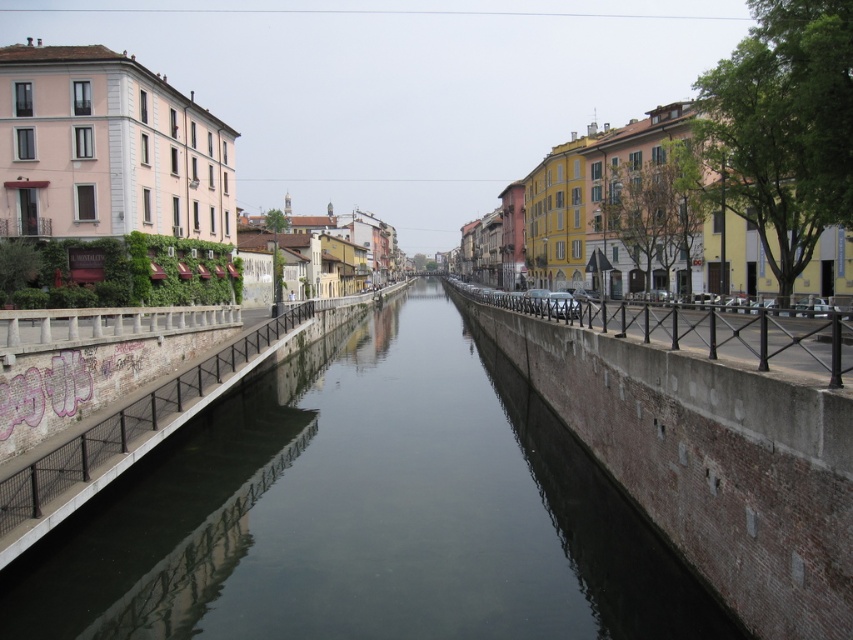
Is smooth concrete canal at center positioned before concrete bridge at center?

Yes, smooth concrete canal at center is in front of concrete bridge at center.

The height and width of the screenshot is (640, 853). Describe the element at coordinates (364, 513) in the screenshot. I see `smooth concrete canal at center` at that location.

Image resolution: width=853 pixels, height=640 pixels. I want to click on smooth concrete canal at center, so click(364, 513).

Is point (612, 310) behind point (108, 476)?

Yes, point (612, 310) is farther from viewer.

Is point (602, 323) more distant than point (221, 394)?

No, it is in front of (221, 394).

At what (x,y) coordinates should I click in order to perform the action: click on black metal railing at center. Please return your answer as a coordinate pair (x, y). Looking at the image, I should click on (703, 328).

Between point (206, 532) and point (844, 346), which one is positioned behind?

The point (206, 532) is more distant.

Can you confirm if smooth concrete canal at center is positioned below black metal railing at center?

Correct, smooth concrete canal at center is located below black metal railing at center.

Locate an element on the screen. smooth concrete canal at center is located at coordinates (364, 513).